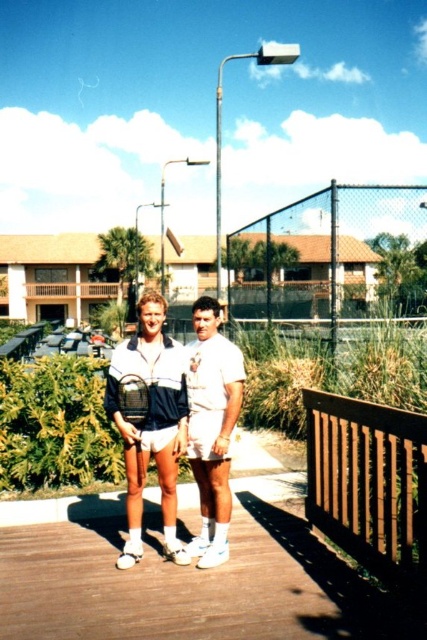
You are a photographer standing at the camera position. You want to capture a closeup shot of the white cotton shorts at center. Considering the distance, is it feasible to take this photo without moving the camera or the subject?

The white cotton shorts at center is 14.55 feet away from the camera. Since this distance is relatively far, it might be challenging to capture a clear closeup without moving the camera or the subject. A telephoto lens could help achieve the desired closeup from this distance.

You are a photographer trying to capture a closeup of the tennis racket and the shorts in the image. Given that the white matte shorts at center are larger in the photo than the black mesh racket at center, which object should you zoom in on first to ensure both are in focus?

The white matte shorts at center are bigger than the black mesh racket at center, so you should zoom in on the white matte shorts at center first to ensure both are in focus.

You are a photographer trying to position two models for a photo shoot. The models are wearing white cotton shorts at center and white matte shorts at center. If you want to ensure that both pairs of shorts are visible in the frame, which detail from their clothing might affect how they appear in the photo?

The white cotton shorts at center might be wider than white matte shorts at center, so the width difference could affect visibility depending on how they are positioned.